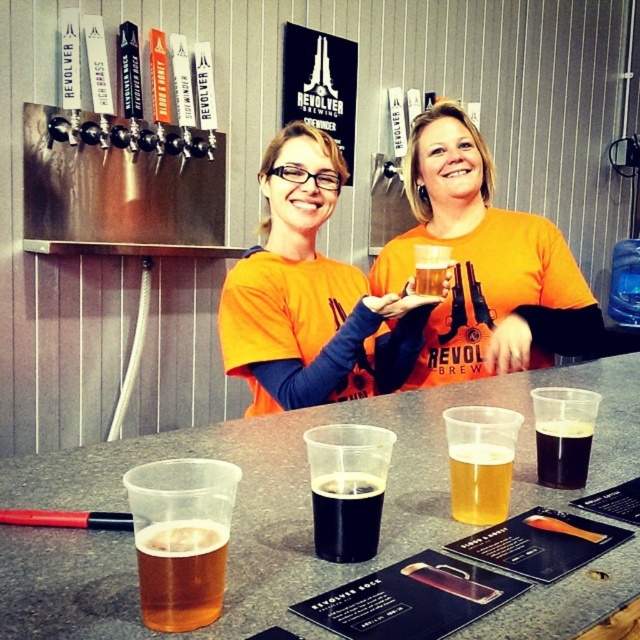
You are a customer at the bar and want to order a drink. The bartender points to the golden amber liquid at center and the orange cotton shirt at center. Which one is taller?

The orange cotton shirt at center is taller than the golden amber liquid at center.